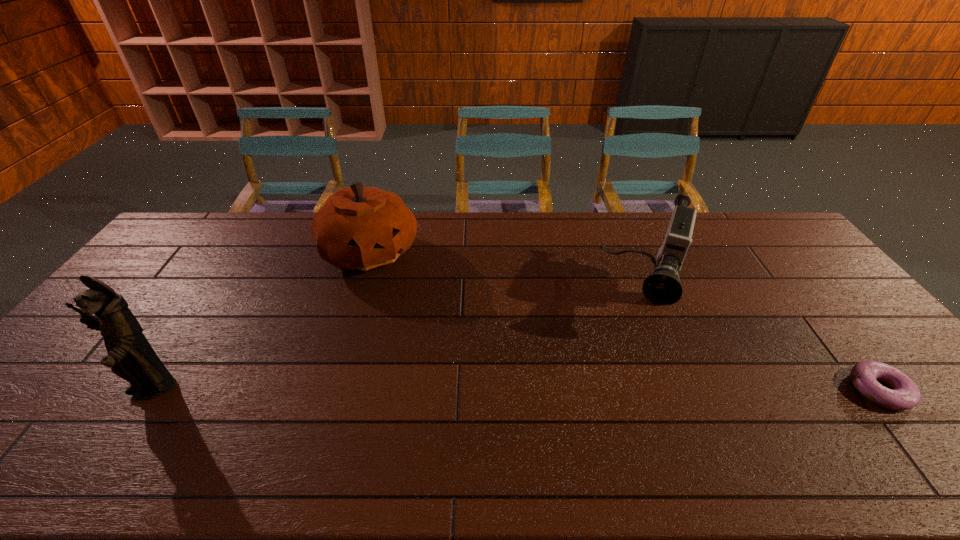
You are a GUI agent. You are given a task and a screenshot of the screen. Output one action in this format:
    pyautogui.click(x=<x>, y=<y>)
    Task: Click on the vacant space on the desktop that is between the leftmost object and the shortest object and is positioned on the front-facing side of the pumpkin
    This screenshot has width=960, height=540.
    Given the screenshot: What is the action you would take?
    pyautogui.click(x=551, y=390)

Where is `vacant spot on the desktop that is between the leftmost object and the rightmost object and is positioned on the recording direction of the second object from right to left`? vacant spot on the desktop that is between the leftmost object and the rightmost object and is positioned on the recording direction of the second object from right to left is located at coordinates (619, 390).